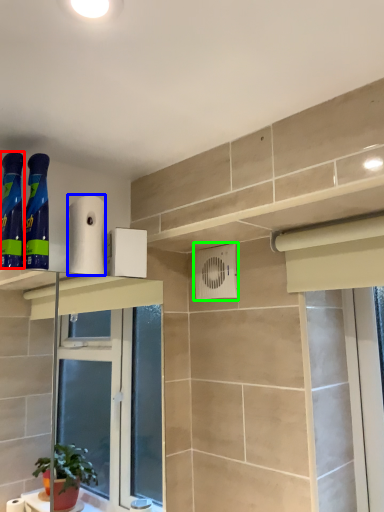
Question: Estimate the real-world distances between objects in this image. Which object is closer to cleaning product (highlighted by a red box), toilet paper (highlighted by a blue box) or air conditioning (highlighted by a green box)?

Choices:
 (A) toilet paper
 (B) air conditioning

Answer: (A)